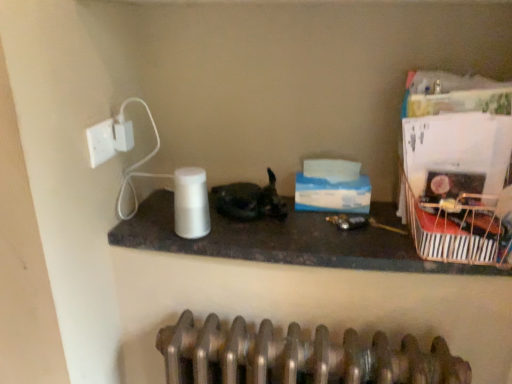
This screenshot has width=512, height=384. I want to click on free spot to the left of shiny black cat at center, so click(x=162, y=213).